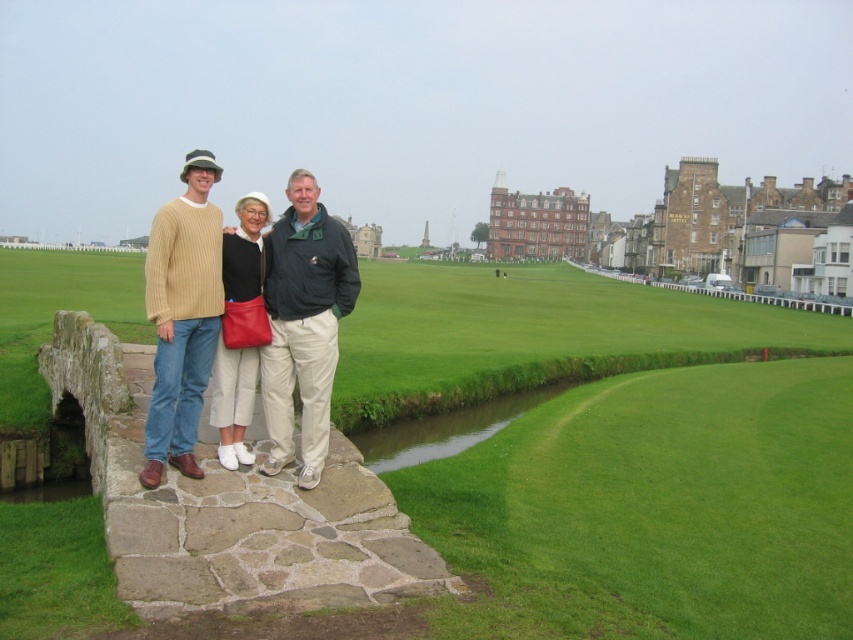
From the picture: You are standing on the stone bridge and want to take a photo of the green grass at center and the dark green textured jacket at center. Which object will appear larger in the photo?

The green grass at center will appear larger in the photo because it is closer to the viewer than the dark green textured jacket at center.

You are a golfer preparing to hit a ball from the green grass at center towards the flag. Considering the width of the matte black jacket at center, will your ball roll straight without hitting any obstacles?

The green grass at center has a larger width than the matte black jacket at center, so the ball should roll straight as there is enough space between them.

Based on the photo, you are standing on the stone bridge and want to walk directly to the green grass at center. Which direction should you walk?

The green grass at center is located at coordinates 0.708 on the x and 0.723 on the y axis, so you should walk forward and to the right from the stone bridge to reach it.